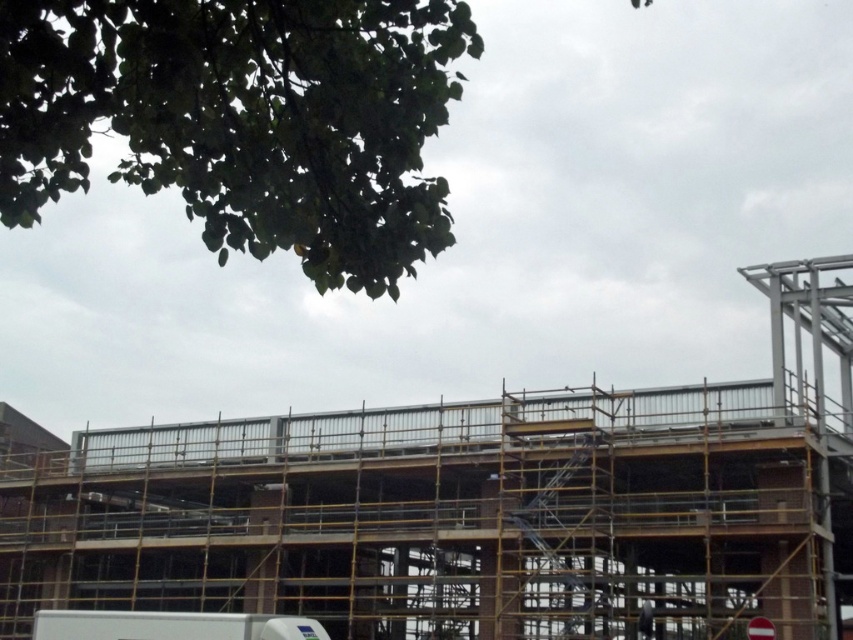
Question: Is metal scaffolding at center to the right of dark gray fabric construction worker at lower right from the viewer's perspective?

Choices:
 (A) yes
 (B) no

Answer: (B)

Question: Which of the following is the farthest from the observer?

Choices:
 (A) (786, 506)
 (B) (648, 621)

Answer: (A)

Question: Which object appears farthest from the camera in this image?

Choices:
 (A) dark gray fabric construction worker at lower right
 (B) metal scaffolding at center

Answer: (A)

Question: Considering the relative positions of metal scaffolding at center and dark gray fabric construction worker at lower right in the image provided, where is metal scaffolding at center located with respect to dark gray fabric construction worker at lower right?

Choices:
 (A) right
 (B) left

Answer: (B)

Question: Does metal scaffolding at center have a greater width compared to dark gray fabric construction worker at lower right?

Choices:
 (A) yes
 (B) no

Answer: (A)